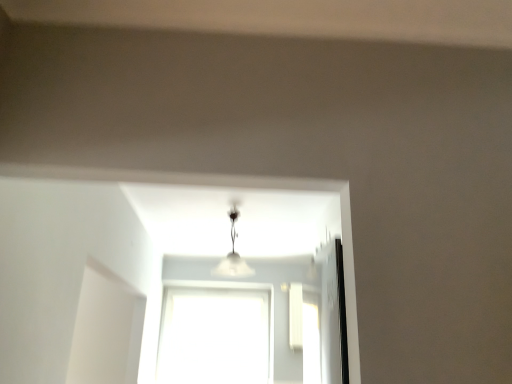
Question: In the image, is transparent glass window at center on the left side or the right side of white frosted glass lamp at center?

Choices:
 (A) right
 (B) left

Answer: (B)

Question: From the image's perspective, relative to white frosted glass lamp at center, is transparent glass window at center above or below?

Choices:
 (A) below
 (B) above

Answer: (A)

Question: Is point (239, 370) positioned closer to the camera than point (233, 249)?

Choices:
 (A) closer
 (B) farther

Answer: (B)

Question: Considering the positions of white frosted glass lamp at center and transparent glass window at center in the image, is white frosted glass lamp at center wider or thinner than transparent glass window at center?

Choices:
 (A) wide
 (B) thin

Answer: (A)

Question: Is white frosted glass lamp at center situated inside transparent glass window at center or outside?

Choices:
 (A) outside
 (B) inside

Answer: (A)

Question: Is white frosted glass lamp at center to the left or to the right of transparent glass window at center in the image?

Choices:
 (A) left
 (B) right

Answer: (B)

Question: Is point (225, 269) closer or farther from the camera than point (225, 321)?

Choices:
 (A) farther
 (B) closer

Answer: (B)